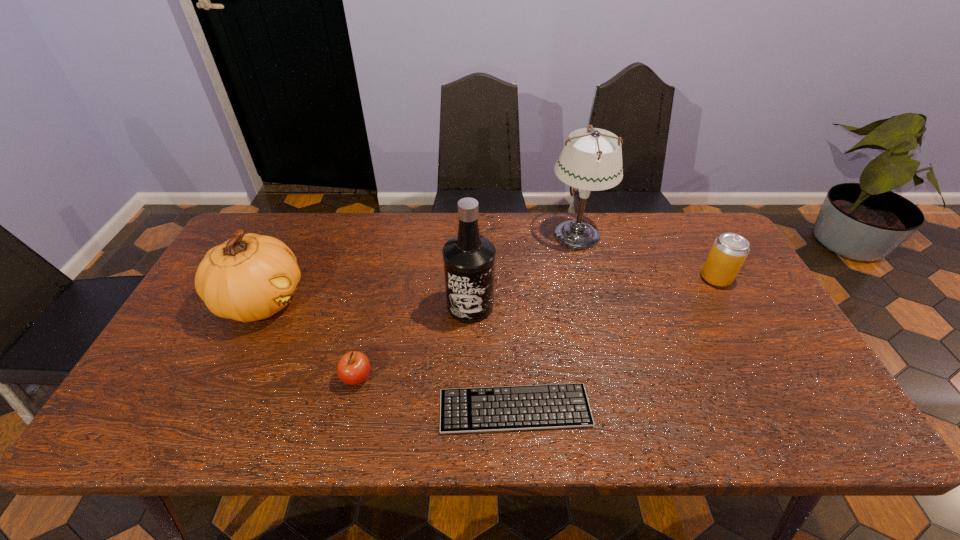
You are a GUI agent. You are given a task and a screenshot of the screen. Output one action in this format:
    pyautogui.click(x=<x>, y=<y>)
    Task: Click on the free space that is in between the computer keyboard and the apple
    Image resolution: width=960 pixels, height=540 pixels.
    Given the screenshot: What is the action you would take?
    pyautogui.click(x=436, y=393)

This screenshot has width=960, height=540. In order to click on free spot between the fourth tallest object and the fifth object from right to left in this screenshot , I will do [537, 328].

You are a GUI agent. You are given a task and a screenshot of the screen. Output one action in this format:
    pyautogui.click(x=<x>, y=<y>)
    Task: Click on the free spot between the liquor and the shortest object
    This screenshot has height=540, width=960.
    Given the screenshot: What is the action you would take?
    pyautogui.click(x=492, y=357)

Where is `free space between the lampshade and the fourth tallest object`? free space between the lampshade and the fourth tallest object is located at coordinates (646, 256).

Image resolution: width=960 pixels, height=540 pixels. What are the coordinates of `free space between the rightmost object and the farthest object` in the screenshot? It's located at (646, 256).

Where is `vacant space that is in between the liquor and the second object from left to right`? vacant space that is in between the liquor and the second object from left to right is located at coordinates (414, 342).

Where is `object that is the second closest to the pumpkin`? This screenshot has height=540, width=960. object that is the second closest to the pumpkin is located at coordinates (469, 259).

Locate which object ranks fifth in proximity to the farthest object. Please provide its 2D coordinates. Your answer should be formatted as a tuple, i.e. [(x, y)], where the tuple contains the x and y coordinates of a point satisfying the conditions above.

[(250, 277)]

This screenshot has width=960, height=540. I want to click on vacant point that satisfies the following two spatial constraints: 1. on the front face of the shortest object; 2. on the right side of the pumpkin, so click(x=209, y=408).

You are a GUI agent. You are given a task and a screenshot of the screen. Output one action in this format:
    pyautogui.click(x=<x>, y=<y>)
    Task: Click on the free location that satisfies the following two spatial constraints: 1. on the front face of the fifth tallest object; 2. on the right side of the leftmost object
    This screenshot has height=540, width=960.
    Given the screenshot: What is the action you would take?
    pyautogui.click(x=225, y=378)